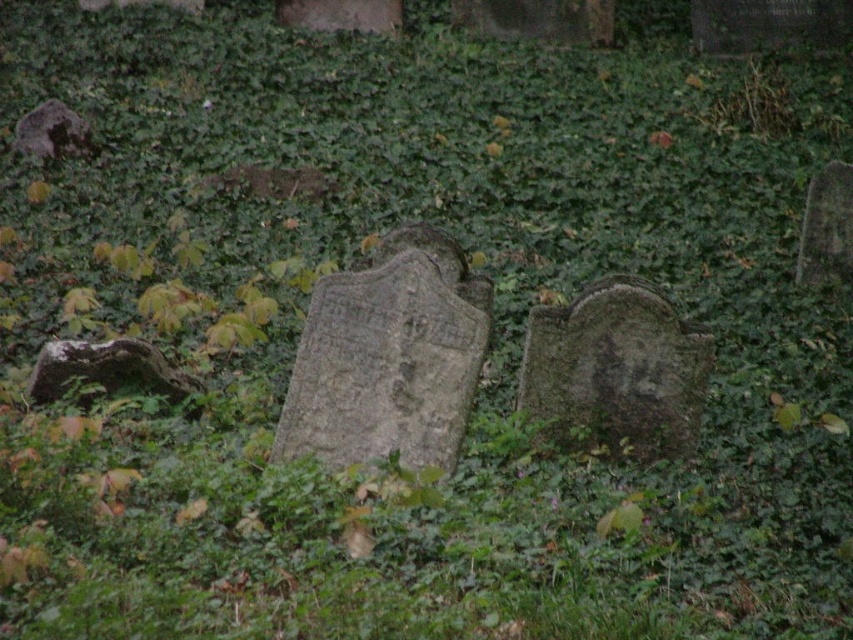
Question: Can you confirm if green mossy gravestone at center is smaller than rusty stone at left?

Choices:
 (A) yes
 (B) no

Answer: (B)

Question: Does gray stone at right have a smaller size compared to rough gray stone at upper left?

Choices:
 (A) no
 (B) yes

Answer: (B)

Question: Which of the following is the closest to the observer?

Choices:
 (A) (543, 358)
 (B) (115, 381)

Answer: (A)

Question: Considering the relative positions of green mossy gravestone at center and rough gray stone at upper left in the image provided, where is green mossy gravestone at center located with respect to rough gray stone at upper left?

Choices:
 (A) left
 (B) right

Answer: (B)

Question: Among these points, which one is nearest to the camera?

Choices:
 (A) (672, 365)
 (B) (819, 209)

Answer: (A)

Question: Estimate the real-world distances between objects in this image. Which object is farther from the rough gray stone at upper left?

Choices:
 (A) green mossy gravestone at center
 (B) rusty stone at left

Answer: (A)